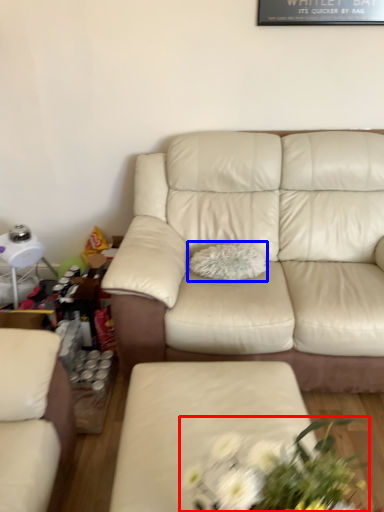
Question: Which of the following is the closest to the observer, floral arrangement (highlighted by a red box) or pillow (highlighted by a blue box)?

Choices:
 (A) floral arrangement
 (B) pillow

Answer: (A)